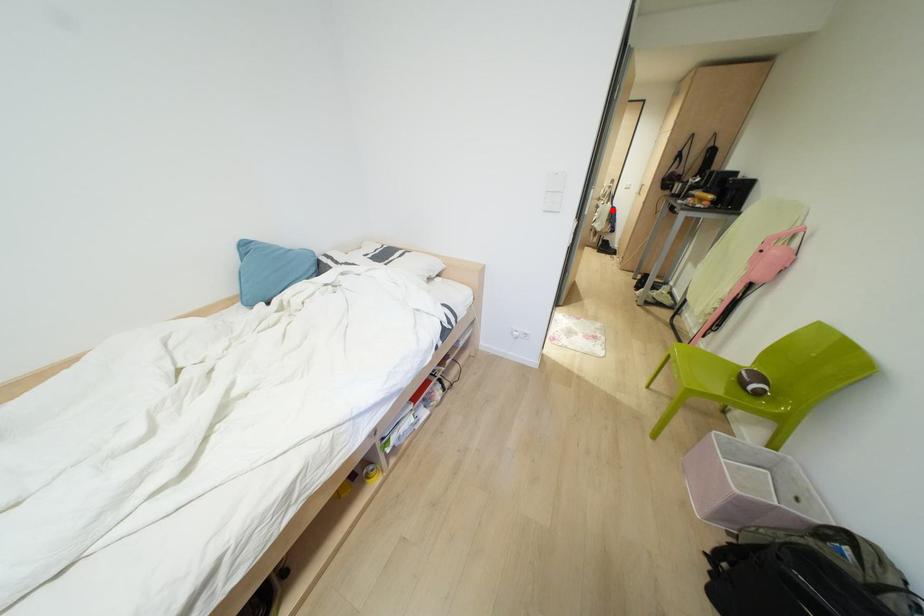
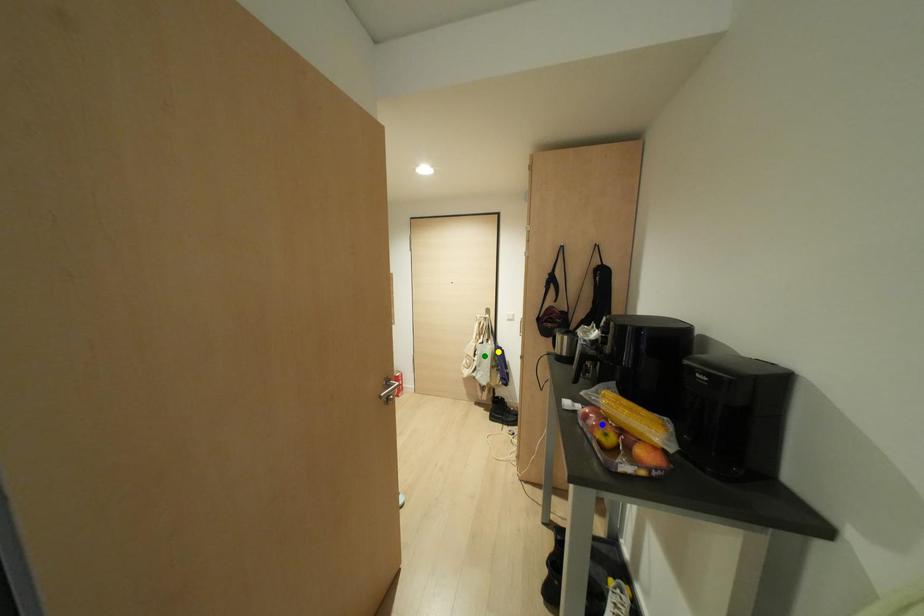
Question: I am providing you with two images of the same scene from different viewpoints. A red point is marked on the first image. You are given multiple points on the second image. Which point in image 2 represents the same 3d spot as the red point in image 1?

Choices:
 (A) green point
 (B) yellow point
 (C) blue point

Answer: (B)